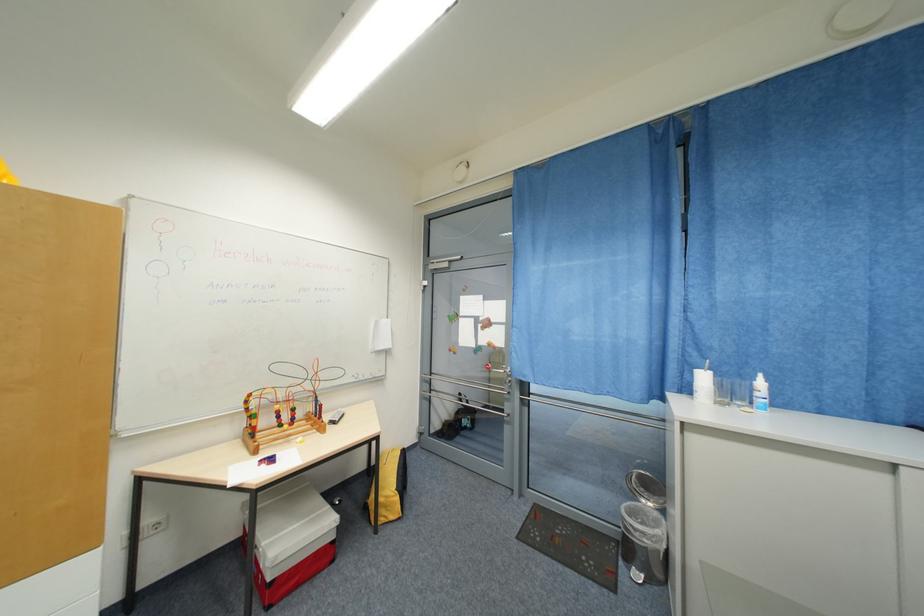
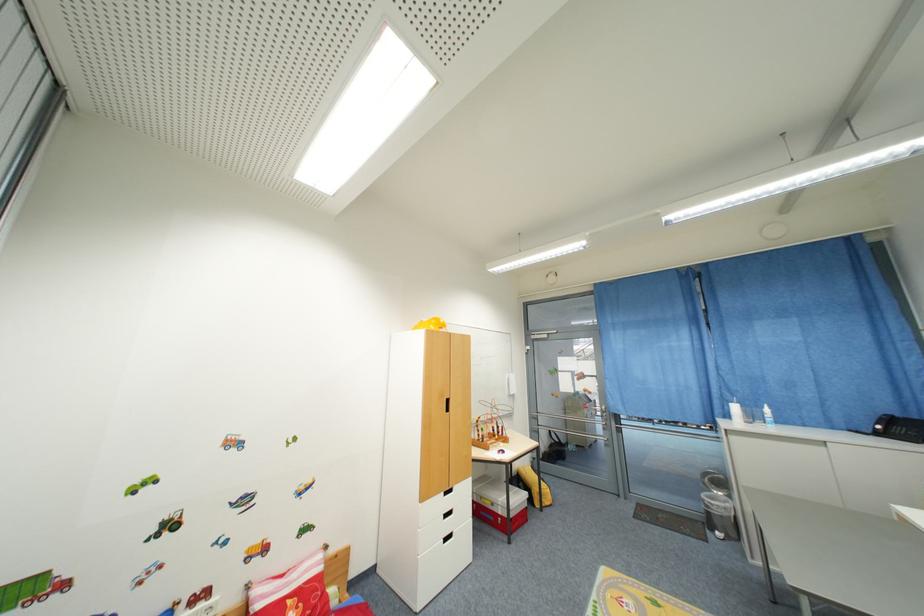
In a continuous first-person perspective shot, in which direction is the camera moving?

The cameraman moved toward left, backward.